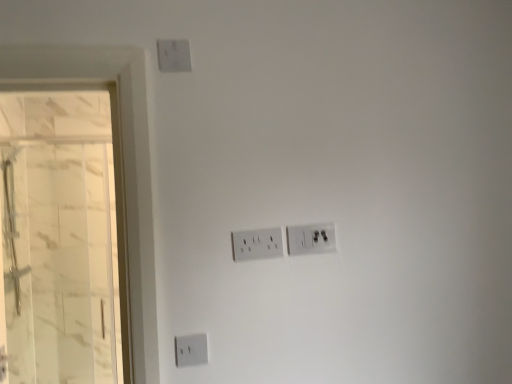
Question: Is white plastic power plugs and sockets at center, which is the 2th power plugs and sockets in right-to-left order, behind white plastic power plugs and sockets at center, placed as the second power plugs and sockets when sorted from left to right?

Choices:
 (A) yes
 (B) no

Answer: (B)

Question: Does white plastic power plugs and sockets at center, the 1th power plugs and sockets viewed from the left, have a greater width compared to white plastic power plugs and sockets at center, marked as the 1th power plugs and sockets in a right-to-left arrangement?

Choices:
 (A) no
 (B) yes

Answer: (A)

Question: Is white plastic power plugs and sockets at center, placed as the second power plugs and sockets when sorted from left to right, completely or partially inside white plastic power plugs and sockets at center, which is the 2th power plugs and sockets in right-to-left order?

Choices:
 (A) yes
 (B) no

Answer: (B)

Question: Considering the relative sizes of white plastic power plugs and sockets at center, the 1th power plugs and sockets viewed from the left, and white plastic power plugs and sockets at center, marked as the 1th power plugs and sockets in a right-to-left arrangement, in the image provided, is white plastic power plugs and sockets at center, the 1th power plugs and sockets viewed from the left, taller than white plastic power plugs and sockets at center, marked as the 1th power plugs and sockets in a right-to-left arrangement,?

Choices:
 (A) yes
 (B) no

Answer: (B)

Question: Is white plastic power plugs and sockets at center, which is the 2th power plugs and sockets in right-to-left order, closer to the viewer compared to white plastic power plugs and sockets at center, marked as the 1th power plugs and sockets in a right-to-left arrangement?

Choices:
 (A) yes
 (B) no

Answer: (A)

Question: Is white marble glass door at left inside the boundaries of white plastic power plugs and sockets at center, marked as the 1th power plugs and sockets in a right-to-left arrangement, or outside?

Choices:
 (A) outside
 (B) inside

Answer: (A)

Question: Considering the positions of white marble glass door at left and white plastic power plugs and sockets at center, marked as the 1th power plugs and sockets in a right-to-left arrangement, in the image, is white marble glass door at left bigger or smaller than white plastic power plugs and sockets at center, marked as the 1th power plugs and sockets in a right-to-left arrangement,?

Choices:
 (A) small
 (B) big

Answer: (B)

Question: Is white marble glass door at left in front of or behind white plastic power plugs and sockets at center, placed as the second power plugs and sockets when sorted from left to right, in the image?

Choices:
 (A) front
 (B) behind

Answer: (B)

Question: From the image's perspective, relative to white plastic power plugs and sockets at center, placed as the second power plugs and sockets when sorted from left to right, is white marble glass door at left above or below?

Choices:
 (A) below
 (B) above

Answer: (A)

Question: Does point (246, 249) appear closer or farther from the camera than point (316, 231)?

Choices:
 (A) farther
 (B) closer

Answer: (B)

Question: Is white plastic power plugs and sockets at center, which is the 2th power plugs and sockets in right-to-left order, in front of or behind white plastic power plugs and sockets at center, placed as the second power plugs and sockets when sorted from left to right, in the image?

Choices:
 (A) behind
 (B) front

Answer: (B)

Question: Based on their positions, is white plastic power plugs and sockets at center, which is the 2th power plugs and sockets in right-to-left order, located to the left or right of white plastic power plugs and sockets at center, placed as the second power plugs and sockets when sorted from left to right?

Choices:
 (A) left
 (B) right

Answer: (A)

Question: Which is correct: white plastic power plugs and sockets at center, which is the 2th power plugs and sockets in right-to-left order, is inside white plastic power plugs and sockets at center, marked as the 1th power plugs and sockets in a right-to-left arrangement, or outside of it?

Choices:
 (A) inside
 (B) outside

Answer: (B)

Question: From a real-world perspective, is white plastic power plugs and sockets at center, the 1th power plugs and sockets viewed from the left, physically located above or below white marble glass door at left?

Choices:
 (A) above
 (B) below

Answer: (A)

Question: Considering the positions of point (250, 233) and point (115, 170), is point (250, 233) closer or farther from the camera than point (115, 170)?

Choices:
 (A) farther
 (B) closer

Answer: (A)